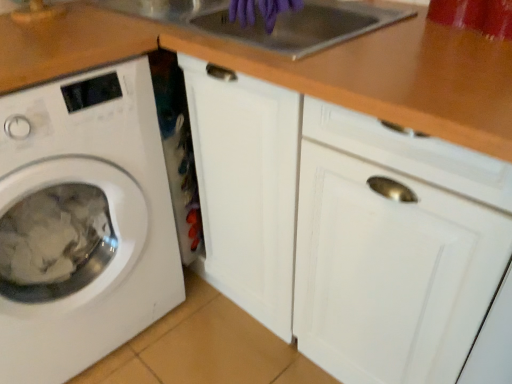
Question: Considering the positions of point (233, 1) and point (25, 284), is point (233, 1) closer or farther from the camera than point (25, 284)?

Choices:
 (A) farther
 (B) closer

Answer: (A)

Question: Considering the positions of purple rubber gloves at upper center and white matte washing machine at left in the image, is purple rubber gloves at upper center taller or shorter than white matte washing machine at left?

Choices:
 (A) tall
 (B) short

Answer: (B)

Question: Which object is positioned farthest from the purple rubber gloves at upper center?

Choices:
 (A) white matte washing machine at left
 (B) wooden at upper center

Answer: (A)

Question: Estimate the real-world distances between objects in this image. Which object is closer to the wooden at upper center?

Choices:
 (A) purple rubber gloves at upper center
 (B) white matte washing machine at left

Answer: (A)